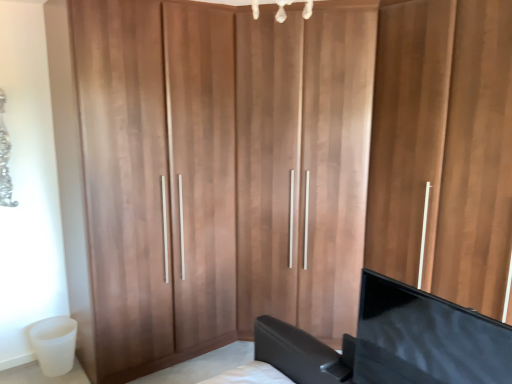
Question: From the image's perspective, is wooden wardrobe at center above or below black glossy tv at lower right?

Choices:
 (A) below
 (B) above

Answer: (B)

Question: Is wooden wardrobe at center wider or thinner than black glossy tv at lower right?

Choices:
 (A) wide
 (B) thin

Answer: (A)

Question: Considering the positions of point (481, 46) and point (420, 306), is point (481, 46) closer or farther from the camera than point (420, 306)?

Choices:
 (A) closer
 (B) farther

Answer: (B)

Question: Considering their positions, is black glossy tv at lower right located in front of or behind wooden wardrobe at center?

Choices:
 (A) front
 (B) behind

Answer: (A)

Question: Is point click(x=503, y=354) closer or farther from the camera than point click(x=475, y=201)?

Choices:
 (A) closer
 (B) farther

Answer: (A)

Question: From the image's perspective, is black glossy tv at lower right positioned above or below wooden wardrobe at center?

Choices:
 (A) above
 (B) below

Answer: (B)

Question: Is black glossy tv at lower right taller or shorter than wooden wardrobe at center?

Choices:
 (A) short
 (B) tall

Answer: (A)